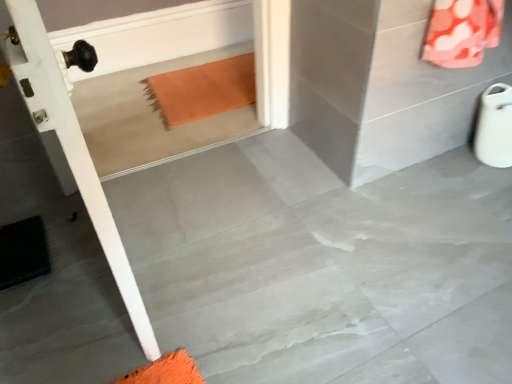
In order to face gray polished concrete at center, should I rotate leftwards or rightwards?

A 6.273 degree turn to the right will do.

Find the location of `orange fabric at upper right`. orange fabric at upper right is located at coordinates (462, 31).

Find the location of a particular element. gray polished concrete at center is located at coordinates (323, 266).

Considering the relative sizes of black rubber doormat at lower left and gray polished concrete at center in the image provided, is black rubber doormat at lower left wider than gray polished concrete at center?

In fact, black rubber doormat at lower left might be narrower than gray polished concrete at center.

Would you consider black rubber doormat at lower left to be distant from gray polished concrete at center?

No, there isn't a large distance between black rubber doormat at lower left and gray polished concrete at center.

Is black rubber doormat at lower left looking in the opposite direction of gray polished concrete at center?

No, black rubber doormat at lower left is not facing the opposite direction of gray polished concrete at center.

Based on their positions, is black rubber doormat at lower left located to the left or right of orange fabric at upper right?

black rubber doormat at lower left is positioned on orange fabric at upper right's left side.

From the picture: What's the angular difference between black rubber doormat at lower left and orange fabric at upper right's facing directions?

There is a 87.8-degree angle between the facing directions of black rubber doormat at lower left and orange fabric at upper right.

Does black rubber doormat at lower left have a greater width compared to orange fabric at upper right?

Correct, the width of black rubber doormat at lower left exceeds that of orange fabric at upper right.

From the image's perspective, which object appears higher, black rubber doormat at lower left or orange fabric at upper right?

orange fabric at upper right appears higher in the image.

Considering the sizes of orange fabric at upper right and black rubber doormat at lower left in the image, is orange fabric at upper right wider or thinner than black rubber doormat at lower left?

Clearly, orange fabric at upper right has less width compared to black rubber doormat at lower left.

Could you tell me if orange fabric at upper right is turned towards black rubber doormat at lower left?

Yes, orange fabric at upper right is aimed at black rubber doormat at lower left.

Does orange fabric at upper right appear on the left side of black rubber doormat at lower left?

In fact, orange fabric at upper right is to the right of black rubber doormat at lower left.

Choose the correct answer: Is orange fabric at upper right inside black rubber doormat at lower left or outside it?

orange fabric at upper right is spatially situated outside black rubber doormat at lower left.

Is orange fabric at upper right wider than gray polished concrete at center?

No, orange fabric at upper right is not wider than gray polished concrete at center.

How different are the orientations of orange fabric at upper right and gray polished concrete at center in degrees?

The facing directions of orange fabric at upper right and gray polished concrete at center are 91.1 degrees apart.

Is orange fabric at upper right next to gray polished concrete at center and touching it?

orange fabric at upper right and gray polished concrete at center are clearly separated.

In the scene shown: How different are the orientations of gray polished concrete at center and orange fabric at upper right in degrees?

gray polished concrete at center and orange fabric at upper right are facing 91.1 degrees away from each other.

Which is in front, point (440, 285) or point (438, 11)?

Positioned in front is point (438, 11).

Can orange fabric at upper right be found inside gray polished concrete at center?

No.

Based on the photo, considering the relative positions of gray polished concrete at center and black rubber doormat at lower left in the image provided, is gray polished concrete at center to the right of black rubber doormat at lower left from the viewer's perspective?

Indeed, gray polished concrete at center is positioned on the right side of black rubber doormat at lower left.

Is gray polished concrete at center surrounding black rubber doormat at lower left?

No.

From a real-world perspective, between gray polished concrete at center and black rubber doormat at lower left, who is vertically higher?

black rubber doormat at lower left, from a real-world perspective.

Which of these two, gray polished concrete at center or black rubber doormat at lower left, is wider?

Wider between the two is gray polished concrete at center.

The height and width of the screenshot is (384, 512). Identify the location of concrete lying in front of the black rubber doormat at lower left. (323, 266).

Identify the location of material above the black rubber doormat at lower left (from a real-world perspective). This screenshot has height=384, width=512. (462, 31).

Based on the photo, when comparing their distances from gray polished concrete at center, does orange fabric at upper right or black rubber doormat at lower left seem further?

Based on the image, orange fabric at upper right appears to be further to gray polished concrete at center.

Estimate the real-world distances between objects in this image. Which object is closer to orange fabric at upper right, gray polished concrete at center or black rubber doormat at lower left?

gray polished concrete at center.

Based on their spatial positions, is black rubber doormat at lower left or gray polished concrete at center further from orange fabric at upper right?

The object further to orange fabric at upper right is black rubber doormat at lower left.

From the image, which object appears to be nearer to black rubber doormat at lower left, gray polished concrete at center or orange fabric at upper right?

Based on the image, gray polished concrete at center appears to be nearer to black rubber doormat at lower left.

Based on their spatial positions, is orange fabric at upper right or gray polished concrete at center further from black rubber doormat at lower left?

Based on the image, orange fabric at upper right appears to be further to black rubber doormat at lower left.

Estimate the real-world distances between objects in this image. Which object is closer to gray polished concrete at center, black rubber doormat at lower left or orange fabric at upper right?

Among the two, black rubber doormat at lower left is located nearer to gray polished concrete at center.

The image size is (512, 384). I want to click on concrete located between black rubber doormat at lower left and orange fabric at upper right in the left-right direction, so click(x=323, y=266).